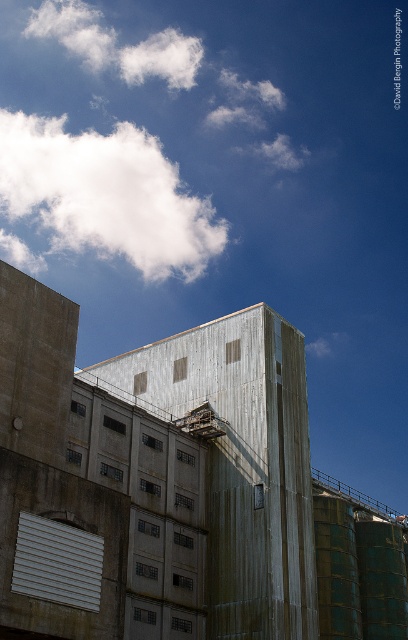
Is point (150, 353) more distant than point (99, 166)?

No, it is in front of (99, 166).

Can you confirm if rusty metal silo at center is positioned to the left of white fluffy cloud at upper left?

In fact, rusty metal silo at center is to the right of white fluffy cloud at upper left.

Who is more distant from viewer, (x=246, y=516) or (x=35, y=189)?

The point (x=35, y=189) is behind.

Where is `rusty metal silo at center`? rusty metal silo at center is located at coordinates (243, 461).